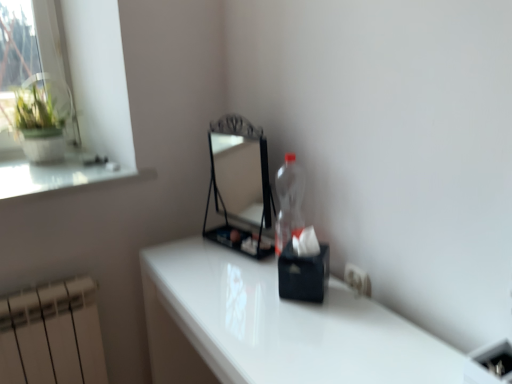
In order to click on free spot in front of metallic black mirror at center in this screenshot , I will do `click(212, 278)`.